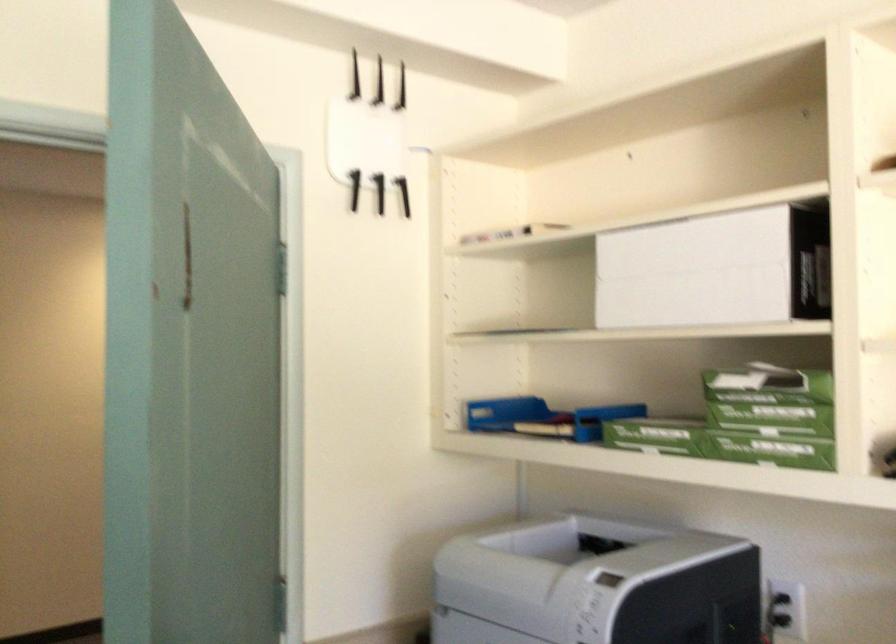
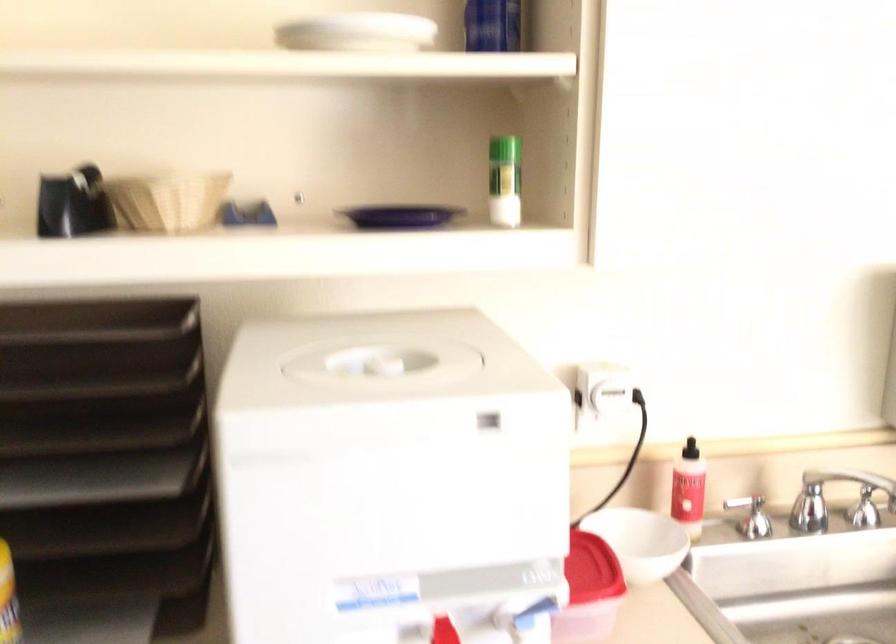
Question: How did the camera likely rotate?

Choices:
 (A) Left
 (B) Right
 (C) Up
 (D) Down

Answer: (B)